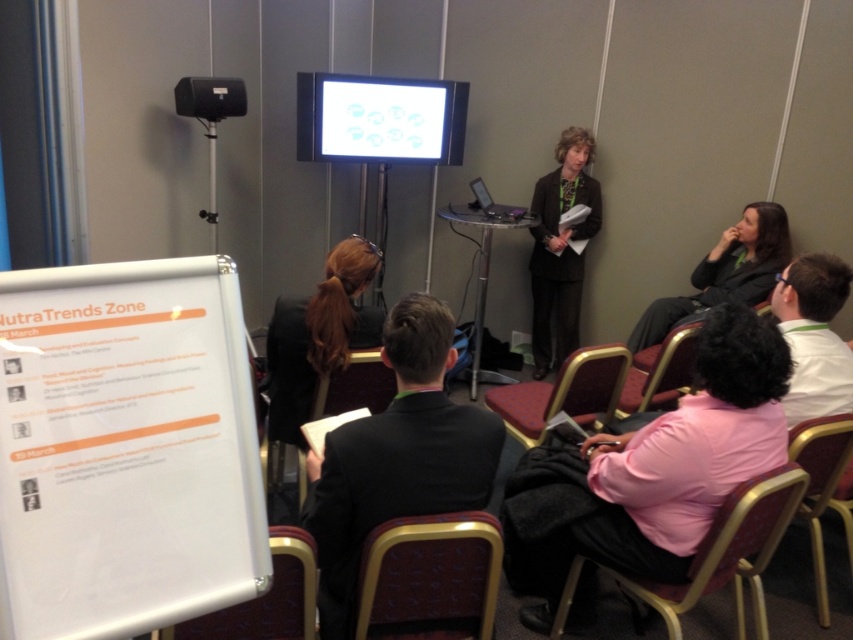
Between black suit at center and wooden textured chair at lower center, which one appears on the left side from the viewer's perspective?

black suit at center

Does point (465, 468) come behind point (397, 550)?

Yes, point (465, 468) is farther from viewer.

Identify the location of black suit at center. (397, 458).

Locate an element on the screen. black suit at center is located at coordinates (397, 458).

Which is in front, point (329, 90) or point (759, 504)?

Positioned in front is point (759, 504).

Who is positioned more to the left, white glossy screen at upper center or metallic gold chair at lower center?

Positioned to the left is white glossy screen at upper center.

Is point (305, 138) less distant than point (675, 584)?

No, it is not.

At what (x,y) coordinates should I click in order to perform the action: click on white glossy screen at upper center. Please return your answer as a coordinate pair (x, y). The image size is (853, 640). Looking at the image, I should click on (379, 120).

Does wooden textured chair at lower center appear under dark gray jacket at lower right?

Yes, wooden textured chair at lower center is below dark gray jacket at lower right.

Describe the element at coordinates (430, 577) in the screenshot. I see `wooden textured chair at lower center` at that location.

Is point (451, 520) in front of point (698, 275)?

Yes.

Identify the location of wooden textured chair at lower center. The width and height of the screenshot is (853, 640). coord(430,577).